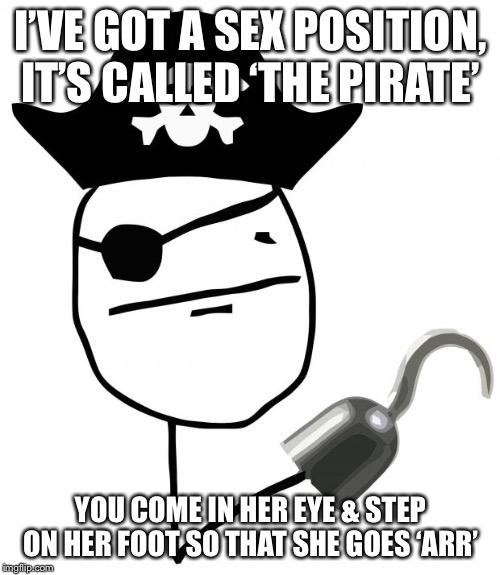
Identify the location of handle. (345, 451).